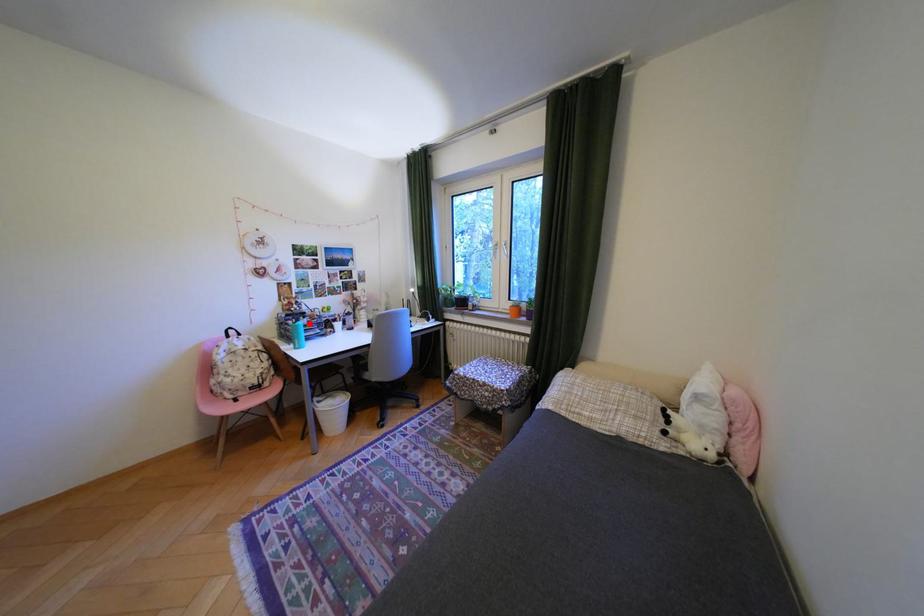
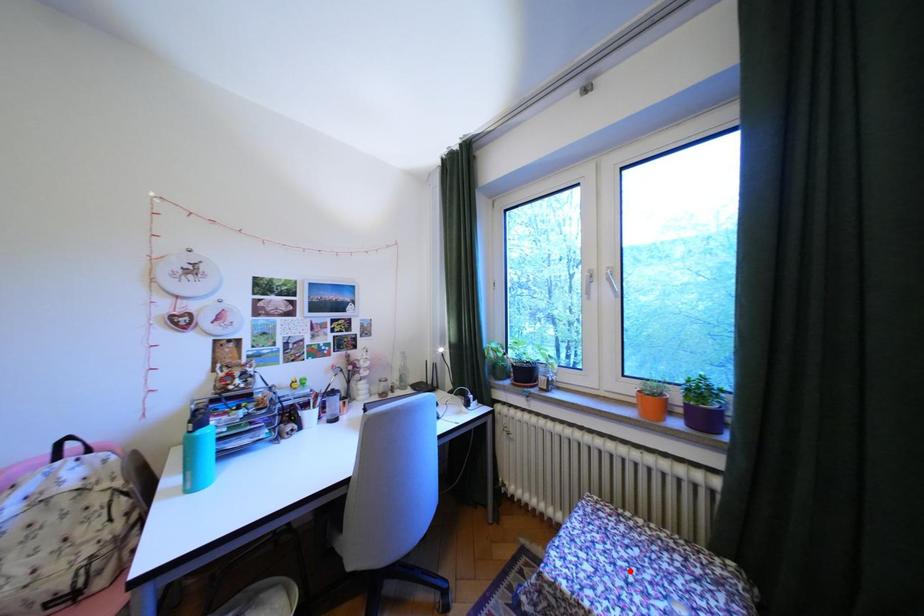
I am providing you with two images of the same scene from different viewpoints. A red point is marked on the first image and another point is marked on the second image. Is the marked point in image1 the same physical position as the marked point in image2?

No